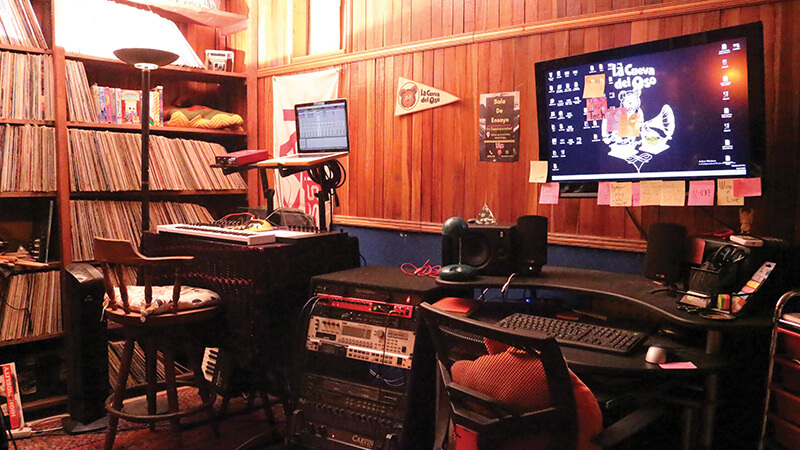
Locate an element on the screen. The width and height of the screenshot is (800, 450). legs of stool is located at coordinates (202, 388), (170, 382), (152, 371), (122, 375).